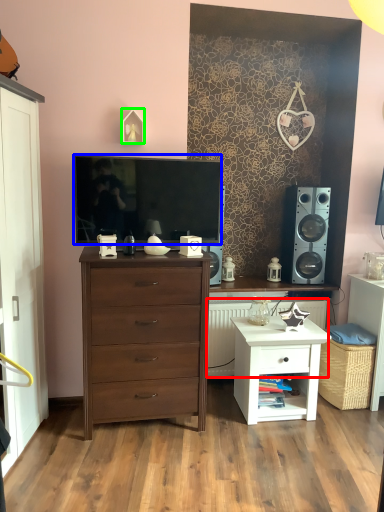
Question: Based on their relative distances, which object is nearer to radiator (highlighted by a red box)? Choose from television (highlighted by a blue box) and picture frame (highlighted by a green box).

Choices:
 (A) television
 (B) picture frame

Answer: (A)